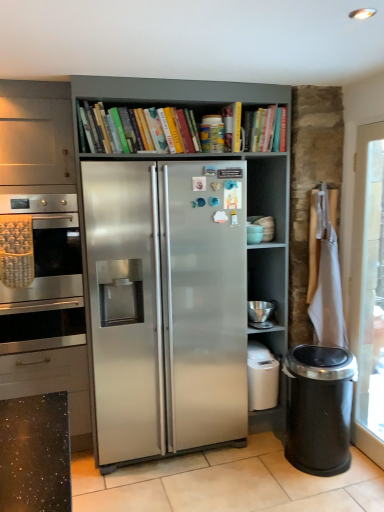
What do you see at coordinates (319, 409) in the screenshot?
I see `black plastic trash can at lower right` at bounding box center [319, 409].

Image resolution: width=384 pixels, height=512 pixels. I want to click on hardcover book at upper center, so click(269, 129).

I want to click on matte ceramic bowls at upper right, which is the first appliance from top to bottom, so click(254, 233).

Which of these two, hardcover books at upper center or matte ceramic bowls at upper right, which is the first appliance from top to bottom, stands taller?

hardcover books at upper center.

Which object is positioned more to the right, hardcover books at upper center or matte ceramic bowls at upper right, the 2th appliance in the bottom-to-top sequence?

matte ceramic bowls at upper right, the 2th appliance in the bottom-to-top sequence, is more to the right.

From the picture: Is hardcover books at upper center turned away from matte ceramic bowls at upper right, the 2th appliance in the bottom-to-top sequence?

No, hardcover books at upper center is not facing the opposite direction of matte ceramic bowls at upper right, the 2th appliance in the bottom-to-top sequence.

From the image's perspective, which is below, hardcover books at upper center or matte ceramic bowls at upper right, which is the first appliance from top to bottom?

From the image's view, matte ceramic bowls at upper right, which is the first appliance from top to bottom, is below.

From the image's perspective, who appears lower, white plastic dish washer at lower right or silver metallic bowl at lower right, the second appliance when ordered from top to bottom?

white plastic dish washer at lower right.

Considering the sizes of objects white plastic dish washer at lower right and silver metallic bowl at lower right, which is counted as the 1th appliance, starting from the bottom, in the image provided, who is shorter, white plastic dish washer at lower right or silver metallic bowl at lower right, which is counted as the 1th appliance, starting from the bottom,?

With less height is silver metallic bowl at lower right, which is counted as the 1th appliance, starting from the bottom.

How far apart are white plastic dish washer at lower right and silver metallic bowl at lower right, which is counted as the 1th appliance, starting from the bottom?

29.69 centimeters.

From the image's perspective, starting from the white plastic dish washer at lower right, which appliance is the 1st one above? Please provide its 2D coordinates.

[(260, 314)]

From a real-world perspective, which is physically above, silver metallic bowl at lower right, the second appliance when ordered from top to bottom, or hardcover books at upper center?

hardcover books at upper center, from a real-world perspective.

Between silver metallic bowl at lower right, the second appliance when ordered from top to bottom, and hardcover books at upper center, which one has less height?

silver metallic bowl at lower right, the second appliance when ordered from top to bottom, is shorter.

How many degrees apart are the facing directions of silver metallic bowl at lower right, which is counted as the 1th appliance, starting from the bottom, and hardcover books at upper center?

1.29 degrees separate the facing orientations of silver metallic bowl at lower right, which is counted as the 1th appliance, starting from the bottom, and hardcover books at upper center.

The image size is (384, 512). Find the location of `shelf positioned vertically above the silver metallic bowl at lower right, the second appliance when ordered from top to bottom (from a real-world perspective)`. shelf positioned vertically above the silver metallic bowl at lower right, the second appliance when ordered from top to bottom (from a real-world perspective) is located at coordinates (151, 130).

Considering the relative sizes of black plastic trash can at lower right and hardcover books at upper center in the image provided, is black plastic trash can at lower right smaller than hardcover books at upper center?

Incorrect, black plastic trash can at lower right is not smaller in size than hardcover books at upper center.

Which is in front, point (329, 399) or point (258, 137)?

The point (329, 399) is closer.

From a real-world perspective, is black plastic trash can at lower right on hardcover books at upper center?

No, from a real-world perspective, black plastic trash can at lower right is not over hardcover books at upper center

Is hardcover books at upper center located within black plastic trash can at lower right?

No, hardcover books at upper center is not a part of black plastic trash can at lower right.

Is satin silver fridge at center taller or shorter than white plastic dish washer at lower right?

In the image, satin silver fridge at center appears to be taller than white plastic dish washer at lower right.

Does point (278, 302) appear closer or farther from the camera than point (276, 362)?

Point (278, 302) is positioned farther from the camera compared to point (276, 362).

In the scene shown: Is satin silver fridge at center to the left or to the right of white plastic dish washer at lower right in the image?

satin silver fridge at center is positioned on white plastic dish washer at lower right's left side.

Is point (191, 416) behind point (269, 138)?

Yes, it is.

Which of these two, satin silver fridge at center or hardcover book at upper center, is thinner?

Thinner between the two is hardcover book at upper center.

Can you confirm if satin silver fridge at center is bigger than hardcover book at upper center?

Yes.

Find the location of a particular element. This screenshot has width=384, height=512. oven lying in front of the silver metallic bowl at lower right, the second appliance when ordered from top to bottom is located at coordinates (48, 246).

Which of these two, silver metallic bowl at lower right, the second appliance when ordered from top to bottom, or stainless steel oven at left, is smaller?

Smaller between the two is silver metallic bowl at lower right, the second appliance when ordered from top to bottom.

Looking at this image, does silver metallic bowl at lower right, the second appliance when ordered from top to bottom, appear on the right side of stainless steel oven at left?

Correct, you'll find silver metallic bowl at lower right, the second appliance when ordered from top to bottom, to the right of stainless steel oven at left.

Considering the sizes of objects silver metallic bowl at lower right, the second appliance when ordered from top to bottom, and stainless steel oven at left in the image provided, who is wider, silver metallic bowl at lower right, the second appliance when ordered from top to bottom, or stainless steel oven at left?

With larger width is stainless steel oven at left.

Find the location of a particular element. This screenshot has width=384, height=512. shelf to the left of matte ceramic bowls at upper right, which is the first appliance from top to bottom is located at coordinates (151, 130).

From the image's perspective, starting from the white plastic dish washer at lower right, which appliance is the 1st one above? Please provide its 2D coordinates.

[(260, 314)]

From the image, which object appears to be nearer to hardcover book at upper center, white plastic dish washer at lower right or silver metallic bowl at lower right, the second appliance when ordered from top to bottom?

silver metallic bowl at lower right, the second appliance when ordered from top to bottom, lies closer to hardcover book at upper center than the other object.

In the scene shown: Looking at the image, which one is located further to silver metallic bowl at lower right, the second appliance when ordered from top to bottom, stainless steel oven at left or hardcover book at upper center?

stainless steel oven at left is positioned further to the anchor silver metallic bowl at lower right, the second appliance when ordered from top to bottom.

Which object lies further to the anchor point silver metallic bowl at lower right, which is counted as the 1th appliance, starting from the bottom, hardcover book at upper center or hardcover books at upper center?

The object further to silver metallic bowl at lower right, which is counted as the 1th appliance, starting from the bottom, is hardcover books at upper center.

Looking at the image, which one is located further to hardcover books at upper center, white glossy tile at center or hardcover book at upper center?

white glossy tile at center is further to hardcover books at upper center.

Based on their spatial positions, is white plastic dish washer at lower right or silver metallic bowl at lower right, the second appliance when ordered from top to bottom, closer to satin silver fridge at center?

Among the two, white plastic dish washer at lower right is located nearer to satin silver fridge at center.

When comparing their distances from white plastic dish washer at lower right, does satin silver fridge at center or stainless steel oven at left seem further?

Based on the image, stainless steel oven at left appears to be further to white plastic dish washer at lower right.

Estimate the real-world distances between objects in this image. Which object is further from white glossy tile at center, black plastic trash can at lower right or hardcover books at upper center?

Among the two, hardcover books at upper center is located further to white glossy tile at center.

From the image, which object appears to be farther from black plastic trash can at lower right, white plastic dish washer at lower right or hardcover books at upper center?

hardcover books at upper center lies further to black plastic trash can at lower right than the other object.

Where is `dish washer between hardcover books at upper center and white glossy tile at center in the vertical direction`? dish washer between hardcover books at upper center and white glossy tile at center in the vertical direction is located at coordinates (262, 377).

This screenshot has width=384, height=512. I want to click on oven between hardcover books at upper center and satin silver fridge at center in the vertical direction, so click(x=48, y=246).

Where is `oven between matte ceramic bowls at upper right, the 2th appliance in the bottom-to-top sequence, and white glossy tile at center from top to bottom`? Image resolution: width=384 pixels, height=512 pixels. oven between matte ceramic bowls at upper right, the 2th appliance in the bottom-to-top sequence, and white glossy tile at center from top to bottom is located at coordinates (48, 246).

Identify the location of appliance between stainless steel oven at left and white plastic dish washer at lower right. The image size is (384, 512). pos(254,233).